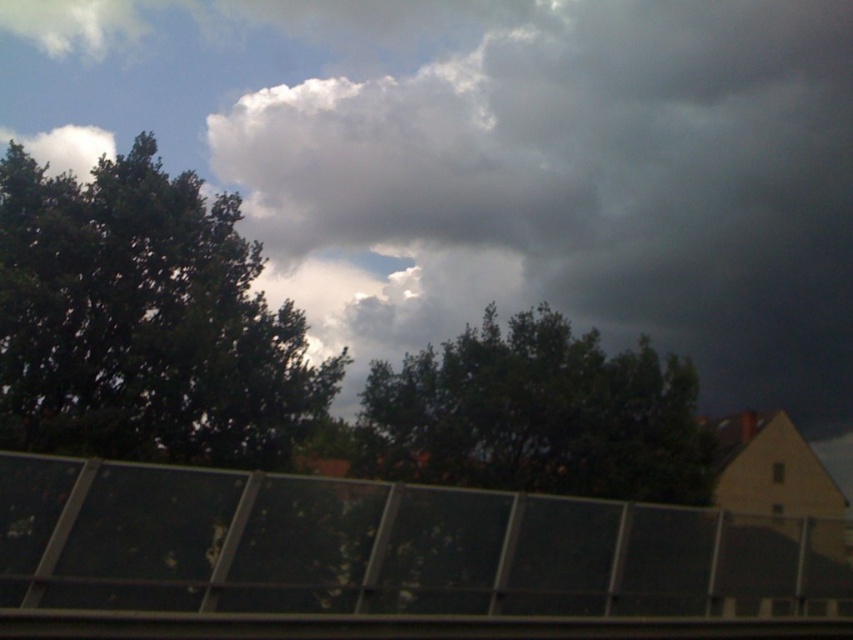
Who is higher up, green leafy tree at left or dark green leafy tree at center?

green leafy tree at left

Does green leafy tree at left have a greater height compared to dark green leafy tree at center?

Correct, green leafy tree at left is much taller as dark green leafy tree at center.

Is point (181, 173) farther from viewer compared to point (581, 420)?

Yes, it is.

Locate an element on the screen. green leafy tree at left is located at coordinates (144, 321).

Does point (814, 259) come in front of point (682, 362)?

No, it is behind (682, 362).

In the scene shown: Does dark gray cloud at upper center come in front of dark green leafy tree at center?

No, dark gray cloud at upper center is behind dark green leafy tree at center.

Is point (550, 12) behind point (635, 435)?

That is True.

This screenshot has width=853, height=640. Identify the location of dark gray cloud at upper center. (573, 179).

Is dark gray cloud at upper center wider than green leafy tree at left?

Yes, dark gray cloud at upper center is wider than green leafy tree at left.

Is dark gray cloud at upper center taller than green leafy tree at left?

Indeed, dark gray cloud at upper center has a greater height compared to green leafy tree at left.

Is point (485, 184) farther from viewer compared to point (1, 285)?

Yes, point (485, 184) is behind point (1, 285).

Locate an element on the screen. dark gray cloud at upper center is located at coordinates (573, 179).